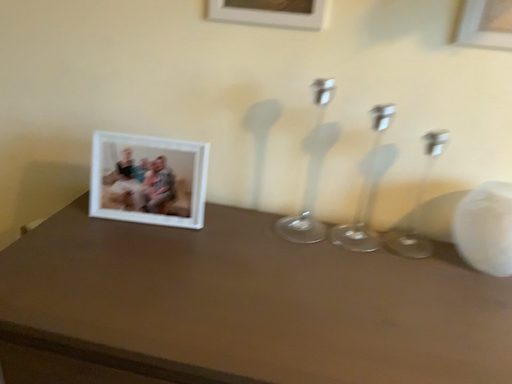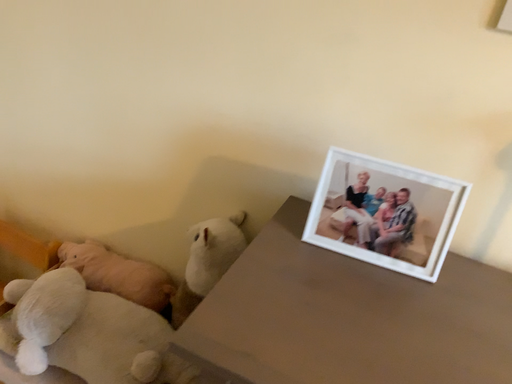
Question: Which way did the camera rotate in the video?

Choices:
 (A) rotated left
 (B) rotated right

Answer: (A)